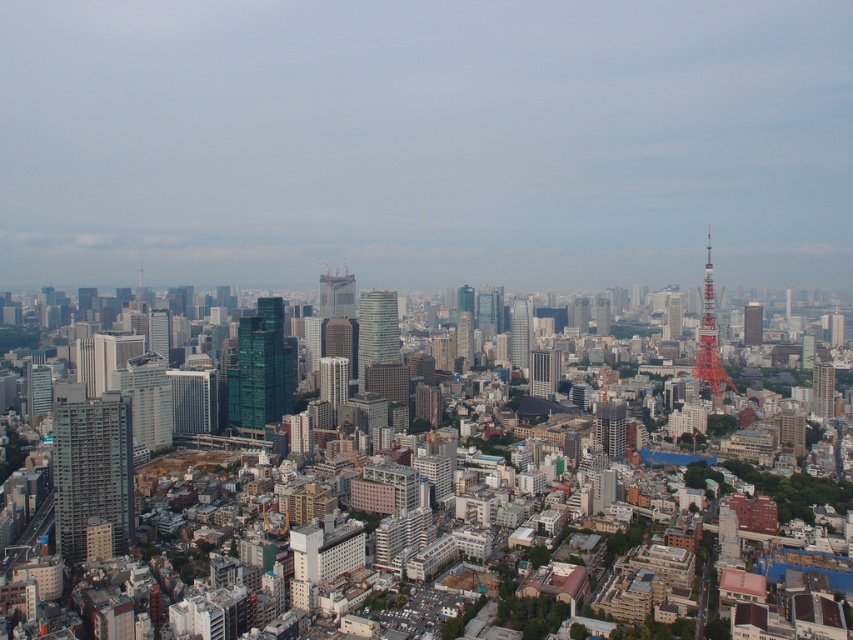
Which of these two, metallic glass building at left or reddish-brown metallic tower at right, stands taller?

metallic glass building at left

Can you confirm if metallic glass building at left is bigger than reddish-brown metallic tower at right?

Indeed, metallic glass building at left has a larger size compared to reddish-brown metallic tower at right.

Is point (132, 532) less distant than point (746, 344)?

Yes, point (132, 532) is closer to viewer.

Identify the location of metallic glass building at left. Image resolution: width=853 pixels, height=640 pixels. (91, 472).

Who is lower down, red glass tower at right or glassy skyscraper at center?

Positioned lower is red glass tower at right.

Who is shorter, red glass tower at right or glassy skyscraper at center?

red glass tower at right is shorter.

Between point (822, 406) and point (466, 326), which one is positioned in front?

Positioned in front is point (822, 406).

Where is `red glass tower at right`? The height and width of the screenshot is (640, 853). red glass tower at right is located at coordinates (822, 388).

Is green glass skyscraper at center bigger than shiny glass skyscraper at center?

Correct, green glass skyscraper at center is larger in size than shiny glass skyscraper at center.

Is green glass skyscraper at center taller than shiny glass skyscraper at center?

Indeed, green glass skyscraper at center has a greater height compared to shiny glass skyscraper at center.

Measure the distance between green glass skyscraper at center and camera.

319.27 meters

Identify the location of green glass skyscraper at center. The height and width of the screenshot is (640, 853). (262, 369).